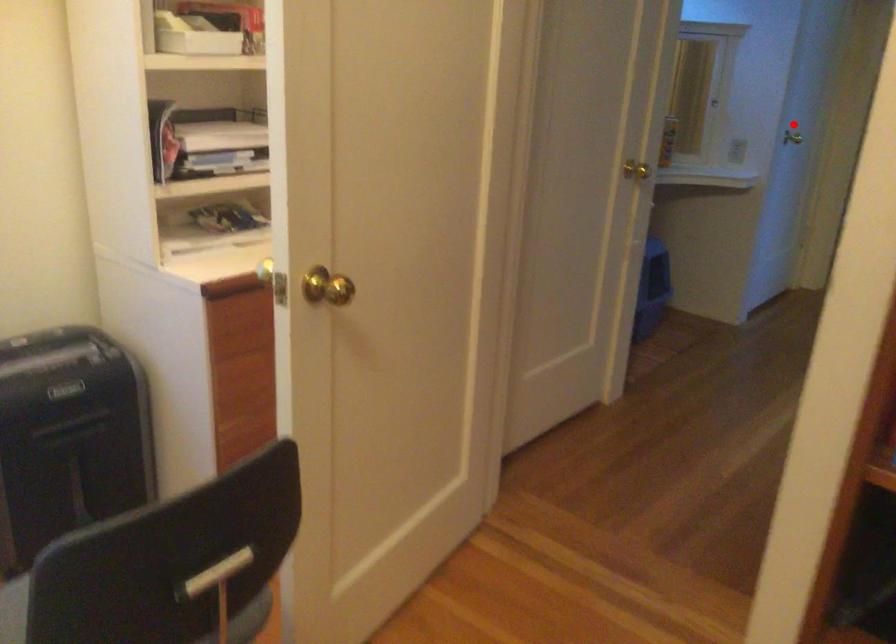
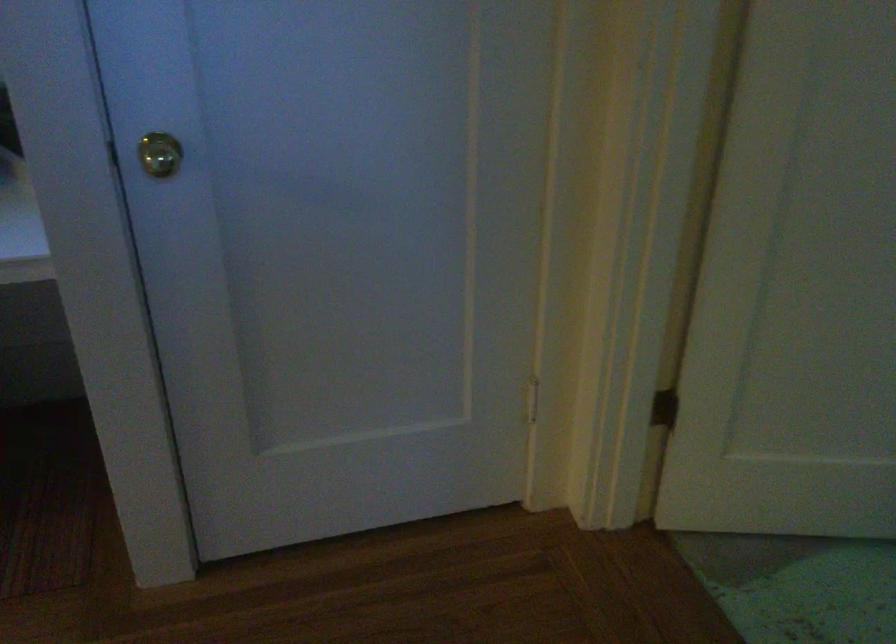
Locate, in the second image, the point that corresponds to the highlighted location in the first image.

(159, 154)